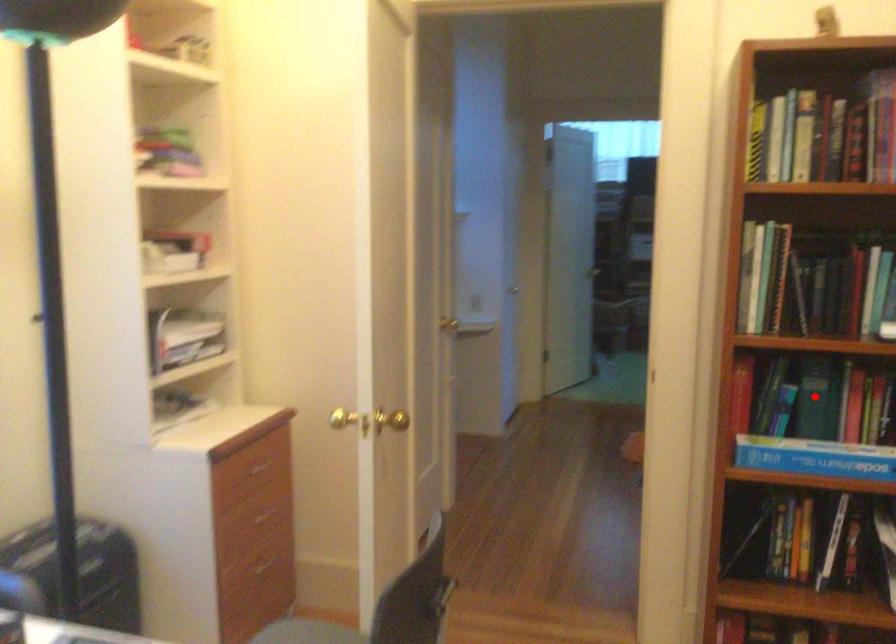
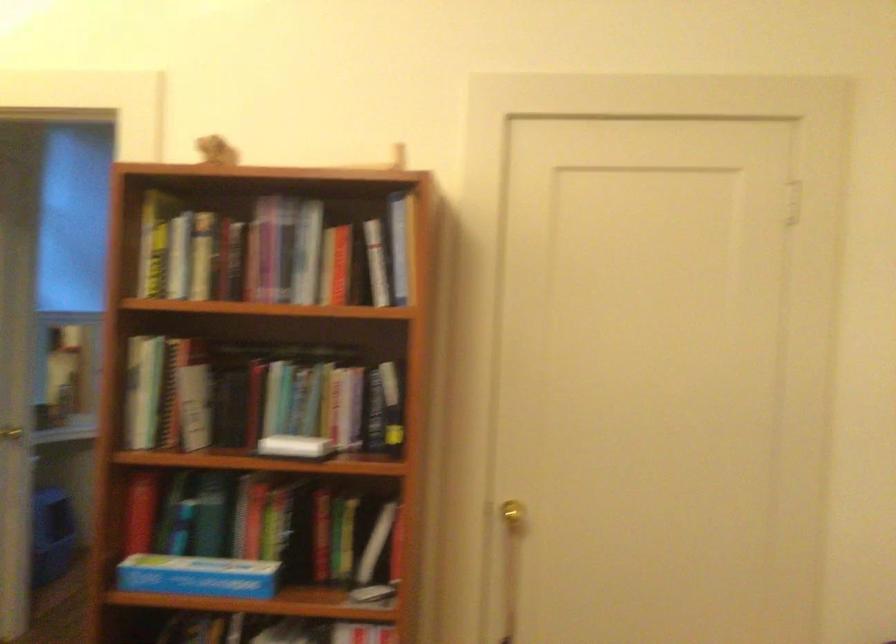
In the second image, find the point that corresponds to the highlighted location in the first image.

(208, 514)